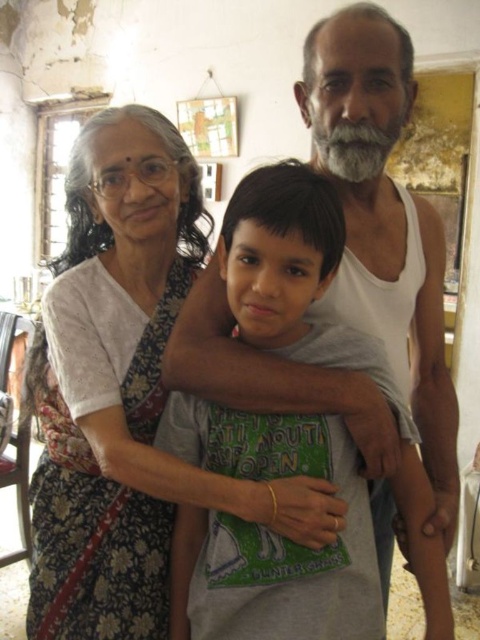
Question: Can you confirm if white cotton tank top at center is bigger than white printed saree at left?

Choices:
 (A) no
 (B) yes

Answer: (B)

Question: Can you confirm if white cotton tank top at center is positioned to the left of white printed saree at left?

Choices:
 (A) yes
 (B) no

Answer: (B)

Question: Which of the following is the farthest from the observer?

Choices:
 (A) (392, 141)
 (B) (55, 620)

Answer: (B)

Question: Which object appears closest to the camera in this image?

Choices:
 (A) white printed saree at left
 (B) white cotton tank top at center

Answer: (B)

Question: Does white cotton tank top at center have a larger size compared to white printed saree at left?

Choices:
 (A) yes
 (B) no

Answer: (A)